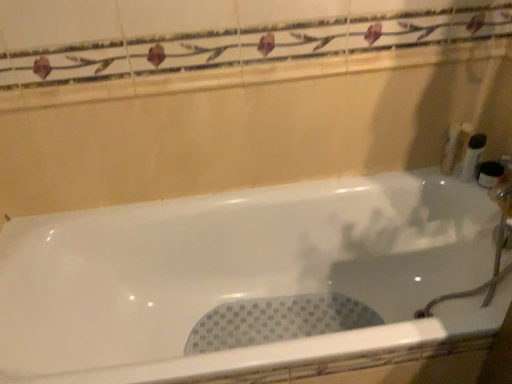
You are a GUI agent. You are given a task and a screenshot of the screen. Output one action in this format:
    pyautogui.click(x=<x>, y=<y>)
    Task: Click on the free spot to the left of white plastic bottle at right, which is the fourth toiletry from left to right
    
    Given the screenshot: What is the action you would take?
    pyautogui.click(x=441, y=182)